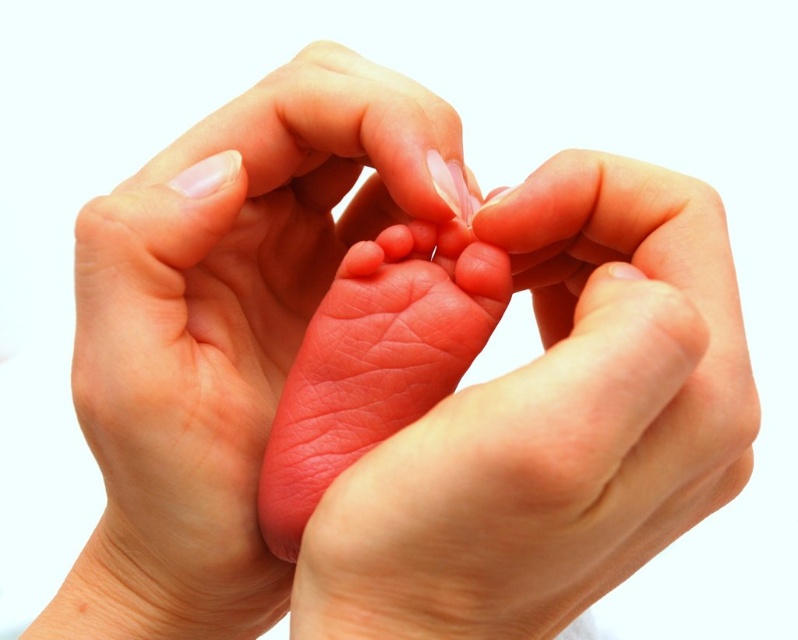
Describe the element at coordinates (552, 426) in the screenshot. The image size is (798, 640). I see `pink smooth foot at center` at that location.

The width and height of the screenshot is (798, 640). I want to click on pink smooth foot at center, so click(x=552, y=426).

This screenshot has width=798, height=640. What do you see at coordinates (552, 426) in the screenshot? I see `pink smooth foot at center` at bounding box center [552, 426].

Where is `pink smooth foot at center`? The image size is (798, 640). pink smooth foot at center is located at coordinates (552, 426).

Which is in front, point (182, 460) or point (626, 276)?

Point (626, 276) is more forward.

Which of these two, smooth skin baby foot at center or pink soft skin at center, stands shorter?

With less height is pink soft skin at center.

The height and width of the screenshot is (640, 798). Find the location of `smooth skin baby foot at center`. smooth skin baby foot at center is located at coordinates (226, 332).

Image resolution: width=798 pixels, height=640 pixels. I want to click on smooth skin baby foot at center, so click(226, 332).

Which is below, pink smooth toe at center or smooth pink toe at center?

pink smooth toe at center is lower down.

Is pink smooth toe at center wider than smooth pink toe at center?

No, pink smooth toe at center is not wider than smooth pink toe at center.

Measure the distance between pink smooth toe at center and camera.

A distance of 13.18 inches exists between pink smooth toe at center and camera.

Locate an element on the screen. pink smooth toe at center is located at coordinates (482, 273).